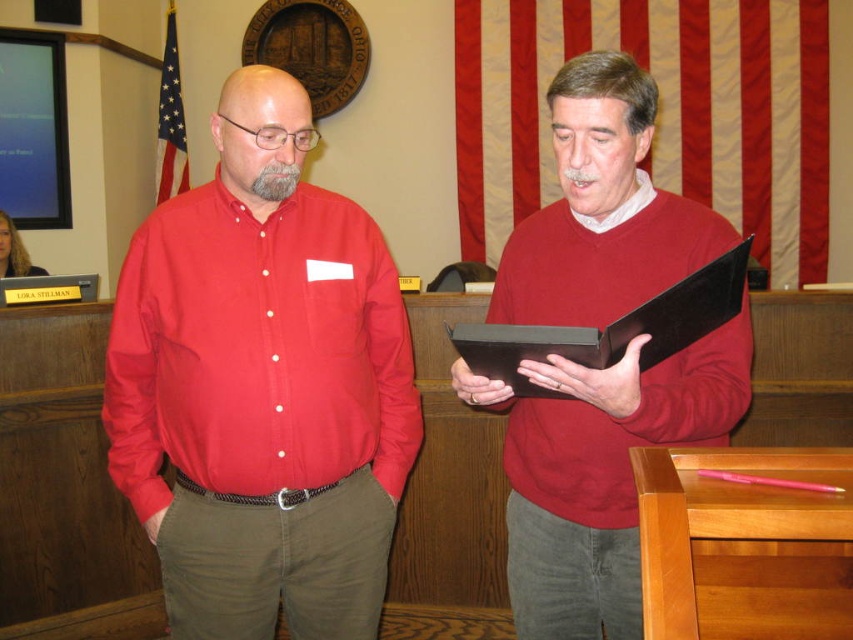
You are an assistant organizing documents in a courtroom. You need to place both the matte black folder at center and the matte cotton shirt at left into a storage box. Which object should you place first to ensure they both fit properly?

The matte black folder at center is larger in size than the matte cotton shirt at left, so you should place the larger folder first to ensure both items fit properly in the storage box.

You are a legal assistant who needs to retrieve the matte black folder at center and the black leather clipboard at center from the table in front of you. Which object should you pick up first to access the other without moving the table?

You should pick up the matte black folder at center first because it is located below the black leather clipboard at center. By lifting the folder first, you won